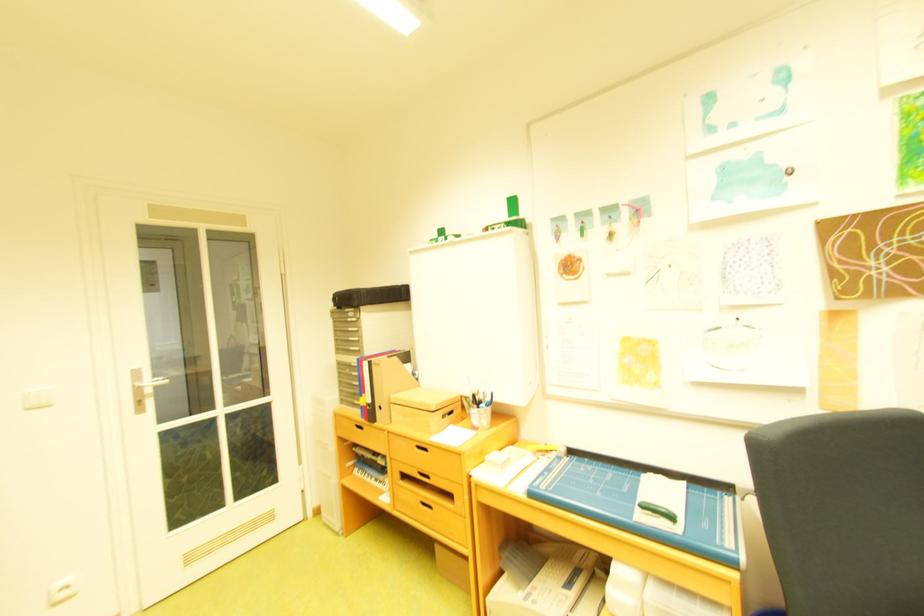
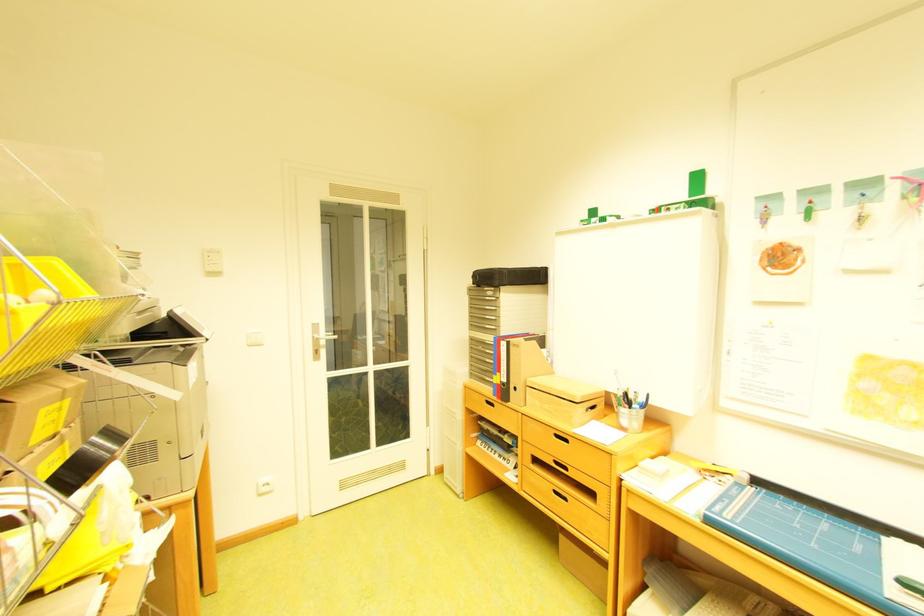
Find the pixel in the second image that matches the point at 483,477 in the first image.

(635, 484)